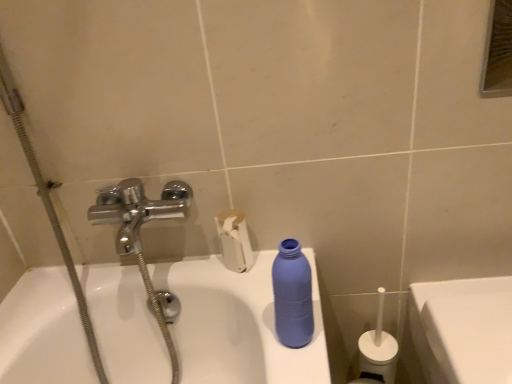
Question: Is white glossy porcelain at lower right aimed at white matte toilet paper at upper center?

Choices:
 (A) no
 (B) yes

Answer: (A)

Question: Is white glossy porcelain at lower right taller than white matte toilet paper at upper center?

Choices:
 (A) no
 (B) yes

Answer: (B)

Question: Does white glossy porcelain at lower right appear on the right side of white matte toilet paper at upper center?

Choices:
 (A) no
 (B) yes

Answer: (B)

Question: Does white glossy porcelain at lower right come in front of white matte toilet paper at upper center?

Choices:
 (A) yes
 (B) no

Answer: (A)

Question: From the image's perspective, is white glossy porcelain at lower right above white matte toilet paper at upper center?

Choices:
 (A) yes
 (B) no

Answer: (B)

Question: Is white glossy porcelain at lower right taller or shorter than matte blue plastic bottle at center?

Choices:
 (A) tall
 (B) short

Answer: (A)

Question: Considering the positions of point (431, 286) and point (307, 269), is point (431, 286) closer or farther from the camera than point (307, 269)?

Choices:
 (A) closer
 (B) farther

Answer: (B)

Question: Looking at their shapes, would you say white glossy porcelain at lower right is wider or thinner than matte blue plastic bottle at center?

Choices:
 (A) wide
 (B) thin

Answer: (A)

Question: Which is correct: white glossy porcelain at lower right is inside matte blue plastic bottle at center, or outside of it?

Choices:
 (A) outside
 (B) inside

Answer: (A)

Question: From their relative heights in the image, would you say white glossy porcelain at lower right is taller or shorter than metallic rectangular mirror at upper right?

Choices:
 (A) tall
 (B) short

Answer: (A)

Question: Based on their sizes in the image, would you say white glossy porcelain at lower right is bigger or smaller than metallic rectangular mirror at upper right?

Choices:
 (A) small
 (B) big

Answer: (B)

Question: Is white glossy porcelain at lower right wider or thinner than metallic rectangular mirror at upper right?

Choices:
 (A) thin
 (B) wide

Answer: (B)

Question: In the image, is white glossy porcelain at lower right positioned in front of or behind metallic rectangular mirror at upper right?

Choices:
 (A) front
 (B) behind

Answer: (A)

Question: From a real-world perspective, is matte blue plastic bottle at center physically located above or below white matte toilet paper at upper center?

Choices:
 (A) above
 (B) below

Answer: (A)

Question: Considering the positions of matte blue plastic bottle at center and white matte toilet paper at upper center in the image, is matte blue plastic bottle at center bigger or smaller than white matte toilet paper at upper center?

Choices:
 (A) big
 (B) small

Answer: (B)